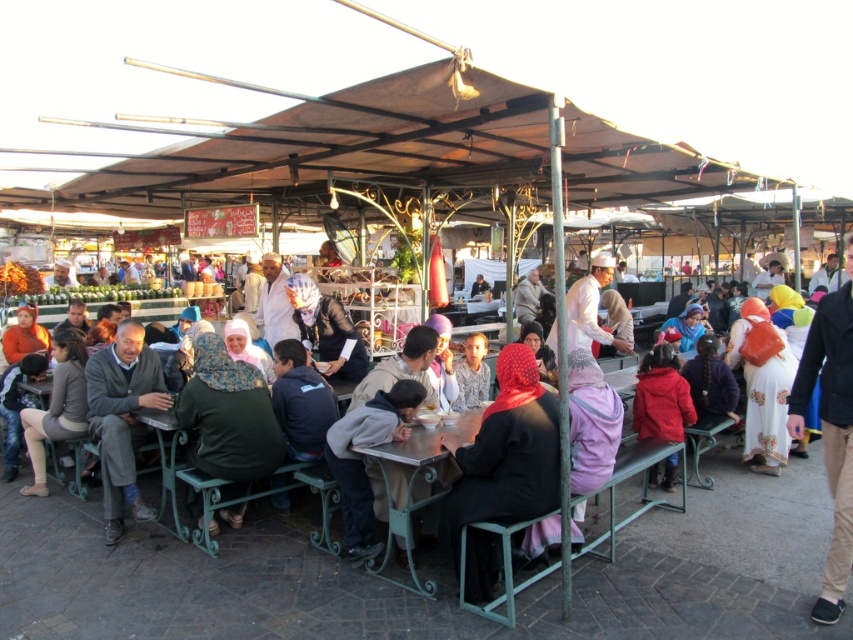
You are a photographer standing at the center of the dining area. You notice the khaki cotton pants at right and the gray wool sweater at left. Which clothing item is positioned higher from the ground?

The khaki cotton pants at right is above gray wool sweater at left, so the khaki cotton pants at right is higher from the ground.

You are standing under the canopy at the market and want to place a small table between the two points labeled point (137, 433) and point (341, 321). Which point is closer to you where you should start placing the table?

Point (137, 433) is closer to the viewer than point (341, 321), so you should start placing the table near point (137, 433) since it is closer.

You are a photographer trying to capture a person wearing both a black fabric headscarf at center and a gray matte jacket at center. Can you see the entire headscarf and jacket in the photo without any obstructions?

The black fabric headscarf at center is positioned over the gray matte jacket at center, so the headscarf may partially or fully obscure the jacket in the photo, making it impossible to see the entire jacket. However, the headscarf itself should be visible since it is on top.